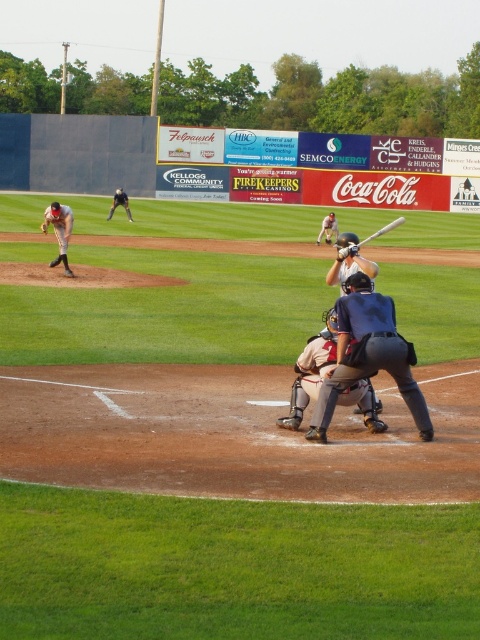
Question: Among these points, which one is nearest to the camera?

Choices:
 (A) (362, 264)
 (B) (322, 227)

Answer: (A)

Question: Which point appears farthest from the camera in this image?

Choices:
 (A) (358, 244)
 (B) (67, 266)
 (C) (326, 232)

Answer: (C)

Question: Which object appears closest to the camera in this image?

Choices:
 (A) blue fabric umpire at center
 (B) brown leather glove at center
 (C) white uniform at left

Answer: (A)

Question: Can you confirm if white uniform at left is bigger than dark gray uniform at center?

Choices:
 (A) yes
 (B) no

Answer: (B)

Question: Does white leather catcher at center have a lesser width compared to matte white bat at center?

Choices:
 (A) yes
 (B) no

Answer: (B)

Question: Does white uniform at left appear on the left side of wooden baseball bat at center?

Choices:
 (A) no
 (B) yes

Answer: (B)